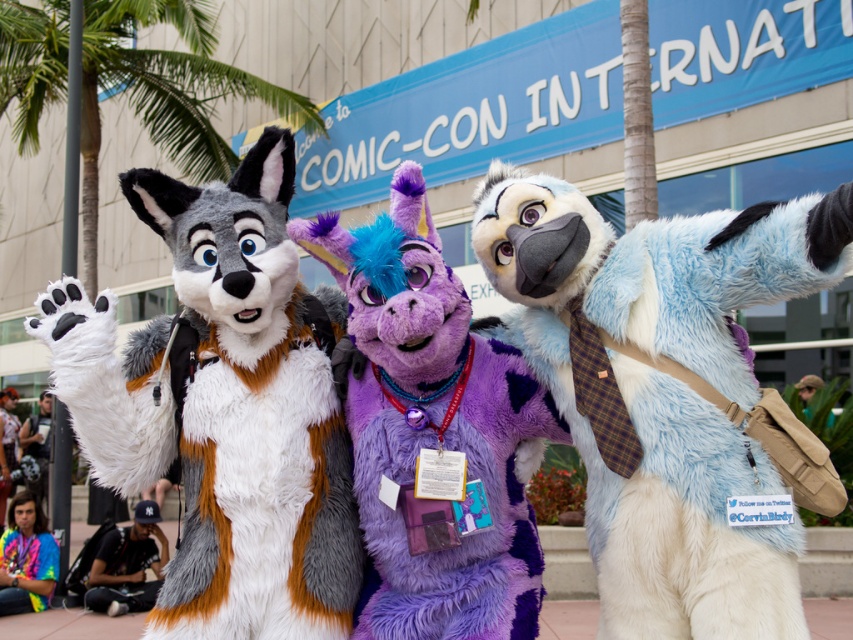
What do you see at coordinates (434, 433) in the screenshot? This screenshot has width=853, height=640. I see `purple plush at center` at bounding box center [434, 433].

Based on the photo, does purple plush at center have a greater height compared to matte black backpack at left?

Correct, purple plush at center is much taller as matte black backpack at left.

Which is in front, point (520, 508) or point (47, 445)?

Positioned in front is point (520, 508).

This screenshot has width=853, height=640. I want to click on purple plush at center, so click(434, 433).

Does white fur wolf at left have a lesser width compared to tie-dye fabric shirt at lower left?

Incorrect, white fur wolf at left's width is not less than tie-dye fabric shirt at lower left's.

Is point (291, 358) closer to camera compared to point (39, 593)?

Yes, it is.

The height and width of the screenshot is (640, 853). Identify the location of white fur wolf at left. (224, 406).

Can you confirm if light blue plush fur at center is taller than matte black backpack at left?

Indeed, light blue plush fur at center has a greater height compared to matte black backpack at left.

Who is positioned more to the right, light blue plush fur at center or matte black backpack at left?

light blue plush fur at center

Is point (496, 243) closer to viewer compared to point (48, 429)?

That is True.

Image resolution: width=853 pixels, height=640 pixels. I want to click on light blue plush fur at center, so click(662, 388).